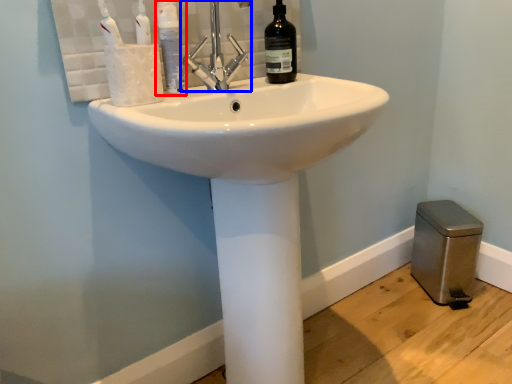
Question: Which of the following is the closest to the observer, mouthwash (highlighted by a red box) or tap (highlighted by a blue box)?

Choices:
 (A) mouthwash
 (B) tap

Answer: (B)